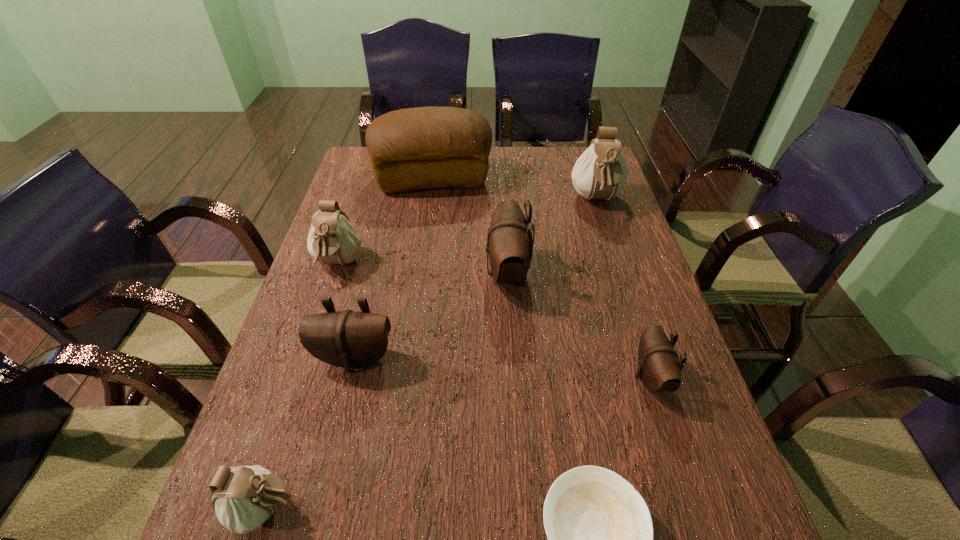
Select which object is the seventh closest to the second biggest white pouch. Please provide its 2D coordinates. Your answer should be formatted as a tuple, i.e. [(x, y)], where the tuple contains the x and y coordinates of a point satisfying the conditions above.

[(658, 366)]

Locate which pouch is the fifth closest to the bread. Please provide its 2D coordinates. Your answer should be formatted as a tuple, i.e. [(x, y)], where the tuple contains the x and y coordinates of a point satisfying the conditions above.

[(658, 366)]

Locate an element on the screen. pouch that is the sixth closest one to the bowl is located at coordinates (600, 172).

I want to click on white pouch that can be found as the closest to the biggest white pouch, so click(x=332, y=239).

Where is `the closest white pouch to the nearest pouch`? The height and width of the screenshot is (540, 960). the closest white pouch to the nearest pouch is located at coordinates click(332, 239).

The width and height of the screenshot is (960, 540). What are the coordinates of `brown pouch that stands as the second closest to the bowl` in the screenshot? It's located at (348, 339).

Find the location of `brown pouch identified as the third closest to the second farthest white pouch`. brown pouch identified as the third closest to the second farthest white pouch is located at coordinates (658, 366).

Identify the location of free space that satisfies the following two spatial constraints: 1. on the front-facing side of the biggest white pouch; 2. with the flap open on the smallest brown pouch. The width and height of the screenshot is (960, 540). (653, 377).

Locate an element on the screen. This screenshot has height=540, width=960. free space that satisfies the following two spatial constraints: 1. on the front-facing side of the farthest pouch; 2. with the flap open on the third pouch from right to left is located at coordinates (619, 273).